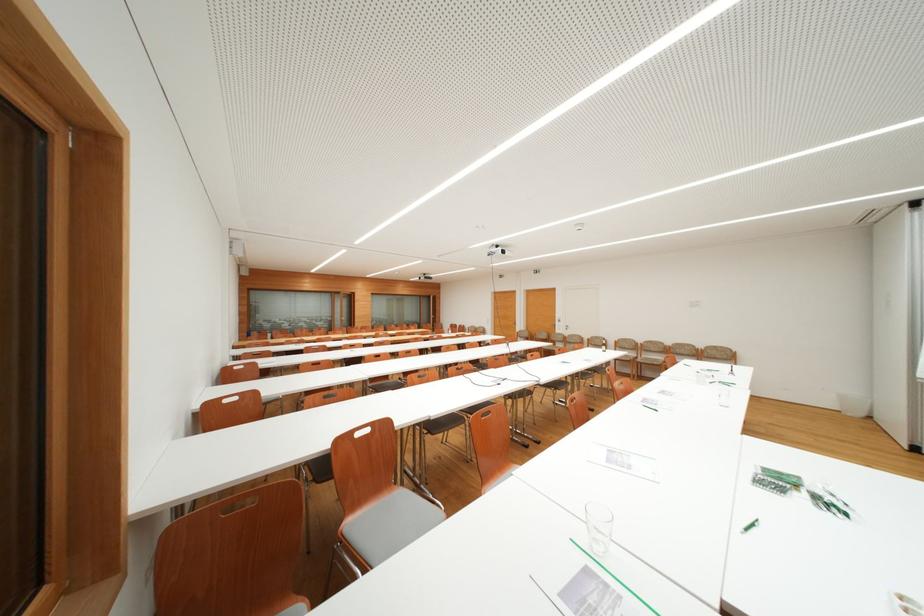
What do you see at coordinates (402, 514) in the screenshot? I see `a chair sitting surface` at bounding box center [402, 514].